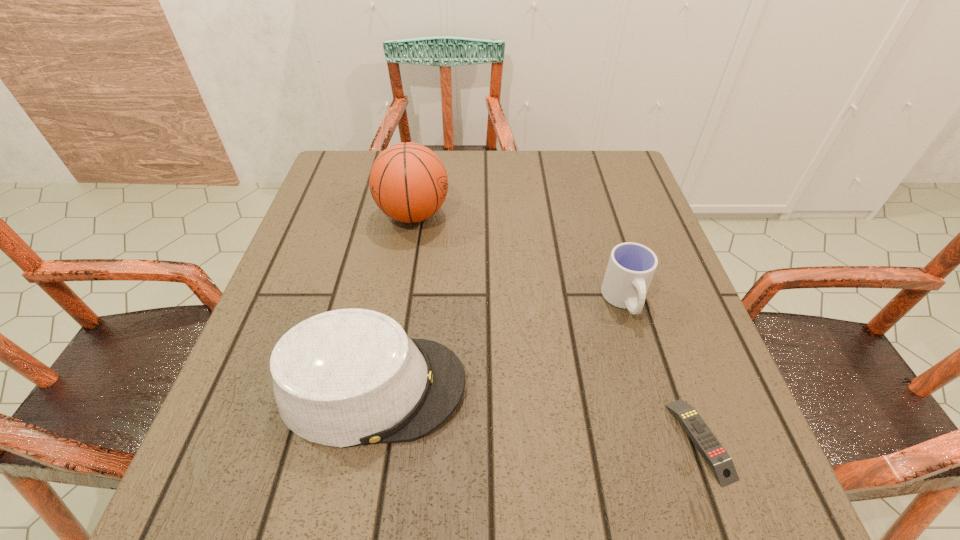
You are a GUI agent. You are given a task and a screenshot of the screen. Output one action in this format:
    pyautogui.click(x=<x>, y=<y>)
    Task: Click on the blank space at the far left corner of the desktop
    This screenshot has height=540, width=960.
    Given the screenshot: What is the action you would take?
    pyautogui.click(x=371, y=197)

Image resolution: width=960 pixels, height=540 pixels. What are the coordinates of `vacant region at the far right corner of the desktop` in the screenshot? It's located at (604, 188).

Identify the location of vacant space at the near right corner of the desktop. The image size is (960, 540). (728, 505).

You are a GUI agent. You are given a task and a screenshot of the screen. Output one action in this format:
    pyautogui.click(x=<x>, y=<y>)
    Task: Click on the empty space between the basketball and the second farthest object
    This screenshot has width=960, height=540.
    Given the screenshot: What is the action you would take?
    [x=519, y=258]

Where is `vacant space that's between the shortest object and the cup`? The height and width of the screenshot is (540, 960). vacant space that's between the shortest object and the cup is located at coordinates (662, 370).

The height and width of the screenshot is (540, 960). In order to click on vacant space in between the second farthest object and the hat in this screenshot , I will do `click(498, 344)`.

You are a GUI agent. You are given a task and a screenshot of the screen. Output one action in this format:
    pyautogui.click(x=<x>, y=<y>)
    Task: Click on the free space between the shortest object and the cup
    The image size is (960, 540).
    Given the screenshot: What is the action you would take?
    pyautogui.click(x=662, y=370)

Where is `vacant area between the farthest object and the second farthest object`? vacant area between the farthest object and the second farthest object is located at coordinates (519, 258).

The image size is (960, 540). Find the location of `vacant area between the hat and the second farthest object`. vacant area between the hat and the second farthest object is located at coordinates (498, 344).

This screenshot has height=540, width=960. Find the location of `unoccupied area between the remote control and the basketball`. unoccupied area between the remote control and the basketball is located at coordinates (557, 327).